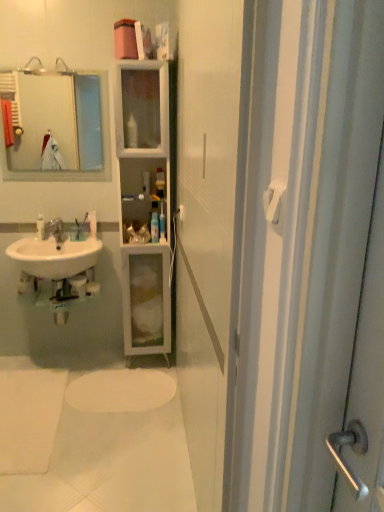
At what (x,y) coordinates should I click in order to perform the action: click on vacant region above white matte oval mat at lower center (from a real-world perspective). Please return your answer as a coordinate pair (x, y). This screenshot has height=512, width=384. Looking at the image, I should click on (74, 413).